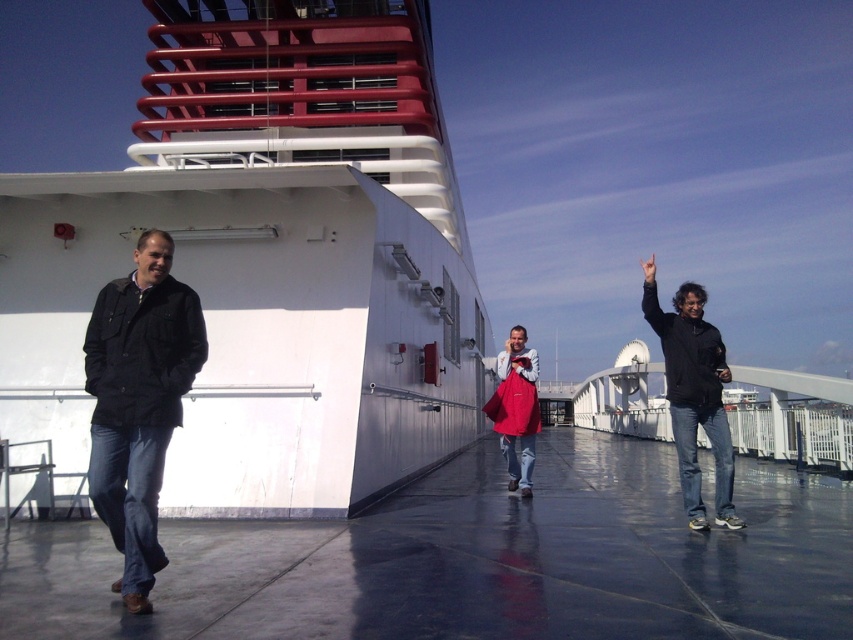
You are navigating a small drone that needs to fly from point A to point B on the cruise ship deck. The coordinates for point A are point (648, 296) and point B are point (520, 362). Considering the deck layout described, which point is closer to you as you control the drone from your position on the deck?

Point (648, 296) is closer to the viewer than point (520, 362), so point A is closer to you as you control the drone from your position on the deck.

You are a photographer standing on the cruise ship deck. You want to take a photo of the black matte jacket at left and the matte red bag at center. Which object should you focus on first to ensure both are in sharp focus?

You should focus on the black matte jacket at left first because it is closer to the viewer than the matte red bag at center, so setting focus on the closer object will help both be in focus if they are within the depth of field.

You are a photographer on the cruise ship deck. You want to take a photo of the black matte jacket at right and the matte red bag at center. Which object should you zoom in on to capture more details of its texture?

The black matte jacket at right has a larger width than the matte red bag at center, so zooming in on the black matte jacket at right would allow you to capture more details of its texture.